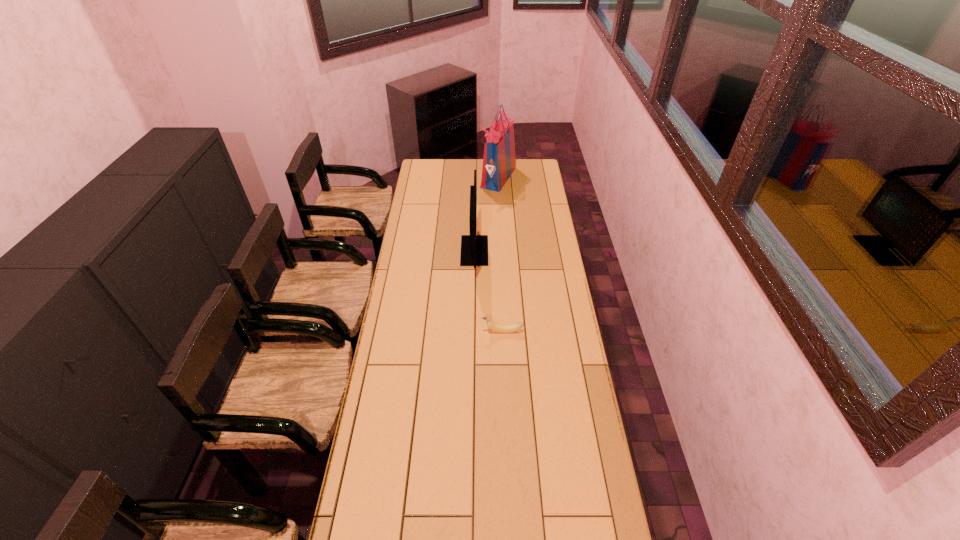
Identify the location of vacant space located at the stem of the shortest object. coord(460,331).

The width and height of the screenshot is (960, 540). What are the coordinates of `vacant space located 0.320m at the stem of the shortest object` in the screenshot? It's located at (404, 331).

Identify the location of blank area located at the stem of the shortest object. (428, 331).

The height and width of the screenshot is (540, 960). Identify the location of object situated at the far edge. (499, 162).

In the image, there is a desktop. At what (x,y) coordinates should I click in order to perform the action: click on free space at the far edge. Please return your answer as a coordinate pair (x, y). This screenshot has height=540, width=960. Looking at the image, I should click on (516, 171).

Locate an element on the screen. This screenshot has height=540, width=960. free region at the left edge of the desktop is located at coordinates (416, 217).

Locate an element on the screen. vacant space at the right edge of the desktop is located at coordinates (539, 226).

This screenshot has width=960, height=540. I want to click on free space at the far right corner of the desktop, so click(x=524, y=160).

The height and width of the screenshot is (540, 960). What are the coordinates of `free space between the banana and the grocery bag` in the screenshot? It's located at pos(500,254).

Locate an element on the screen. free space between the second farthest object and the banana is located at coordinates (489, 291).